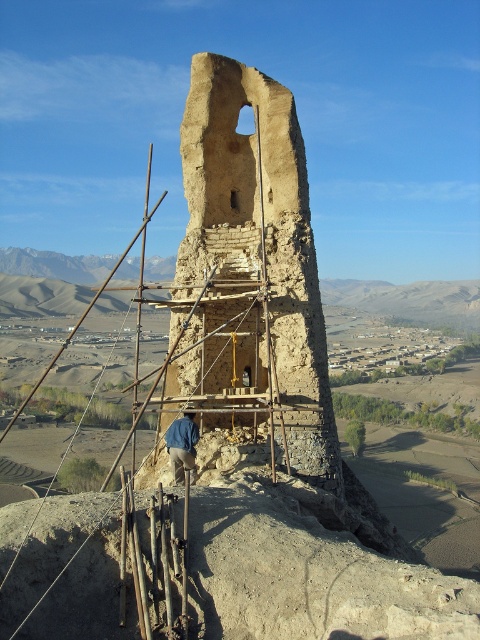
You are standing at the origin point of the coordinate system in the image. The earthy brown stone tower at center is located at point 0.430, 0.521. If you want to move towards the tower, which direction should you move in terms of the coordinate system?

To move towards the earthy brown stone tower at center located at coordinates [250,275] from the origin, you should move in the positive x and positive y direction since both coordinates are greater than zero.